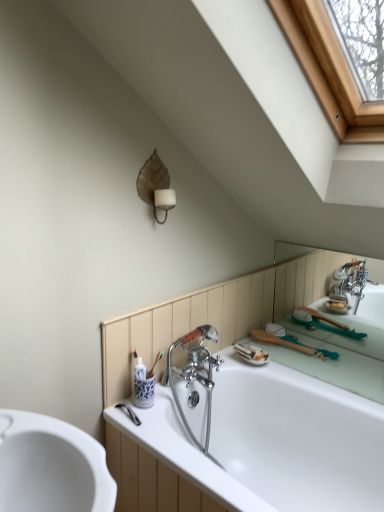
Question: Is brown leaf-shaped sconce at upper center shorter than white glossy bathtub at center?

Choices:
 (A) no
 (B) yes

Answer: (B)

Question: Is brown leaf-shaped sconce at upper center placed right next to white glossy bathtub at center?

Choices:
 (A) yes
 (B) no

Answer: (B)

Question: Does brown leaf-shaped sconce at upper center contain white glossy bathtub at center?

Choices:
 (A) yes
 (B) no

Answer: (B)

Question: From the image's perspective, is brown leaf-shaped sconce at upper center beneath white glossy bathtub at center?

Choices:
 (A) no
 (B) yes

Answer: (A)

Question: From the image's perspective, is brown leaf-shaped sconce at upper center on top of white glossy bathtub at center?

Choices:
 (A) yes
 (B) no

Answer: (A)

Question: Is brown leaf-shaped sconce at upper center taller than white glossy bathtub at center?

Choices:
 (A) yes
 (B) no

Answer: (B)

Question: Can you confirm if white glossy bathtub at center is positioned to the right of brown leaf-shaped sconce at upper center?

Choices:
 (A) yes
 (B) no

Answer: (A)

Question: Is white glossy bathtub at center taller than brown leaf-shaped sconce at upper center?

Choices:
 (A) yes
 (B) no

Answer: (A)

Question: Is white glossy bathtub at center oriented away from brown leaf-shaped sconce at upper center?

Choices:
 (A) no
 (B) yes

Answer: (A)

Question: Considering the relative positions of white glossy bathtub at center and brown leaf-shaped sconce at upper center in the image provided, is white glossy bathtub at center behind brown leaf-shaped sconce at upper center?

Choices:
 (A) no
 (B) yes

Answer: (A)

Question: Is white glossy bathtub at center in contact with brown leaf-shaped sconce at upper center?

Choices:
 (A) no
 (B) yes

Answer: (A)

Question: From the image's perspective, does white glossy bathtub at center appear lower than brown leaf-shaped sconce at upper center?

Choices:
 (A) no
 (B) yes

Answer: (B)

Question: Does point (147, 202) appear closer or farther from the camera than point (241, 465)?

Choices:
 (A) closer
 (B) farther

Answer: (A)